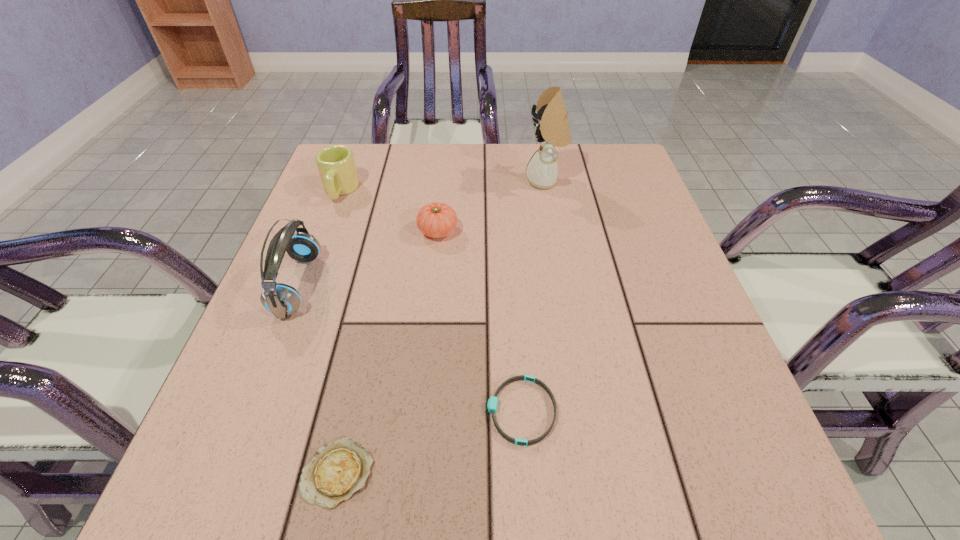
What are the coordinates of `free spot between the fifth shortest object and the shortest object` in the screenshot? It's located at (318, 379).

Locate an element on the screen. Image resolution: width=960 pixels, height=540 pixels. vacant space that is in between the headset and the wristband is located at coordinates (410, 348).

In order to click on vacant area that lies between the headset and the mug in this screenshot , I will do `click(319, 238)`.

Where is `free space between the fourth nearest object and the wristband`? Image resolution: width=960 pixels, height=540 pixels. free space between the fourth nearest object and the wristband is located at coordinates (480, 321).

You are a GUI agent. You are given a task and a screenshot of the screen. Output one action in this format:
    pyautogui.click(x=<x>, y=<y>)
    Task: Click on the free space between the quiche and the second tallest object
    Image resolution: width=960 pixels, height=540 pixels.
    Given the screenshot: What is the action you would take?
    pyautogui.click(x=318, y=379)

Where is `free space between the wristband and the shortest object`? The width and height of the screenshot is (960, 540). free space between the wristband and the shortest object is located at coordinates (430, 441).

This screenshot has height=540, width=960. Find the location of `free space between the fourth object from left to right and the headset`. free space between the fourth object from left to right and the headset is located at coordinates (x=368, y=258).

At what (x,y) coordinates should I click in order to perform the action: click on free point between the third object from right to left and the headset. Please return your answer as a coordinate pair (x, y). The width and height of the screenshot is (960, 540). Looking at the image, I should click on (368, 258).

The width and height of the screenshot is (960, 540). I want to click on free space between the mug and the tallest object, so click(x=443, y=186).

Identify the location of free space between the doll and the wristband. This screenshot has height=540, width=960. (534, 296).